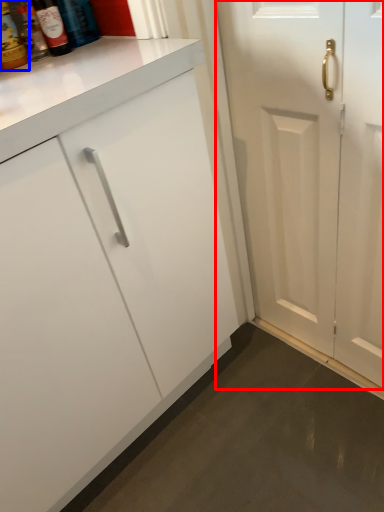
Question: Which object is closer to the camera taking this photo, door (highlighted by a red box) or bottle (highlighted by a blue box)?

Choices:
 (A) door
 (B) bottle

Answer: (A)